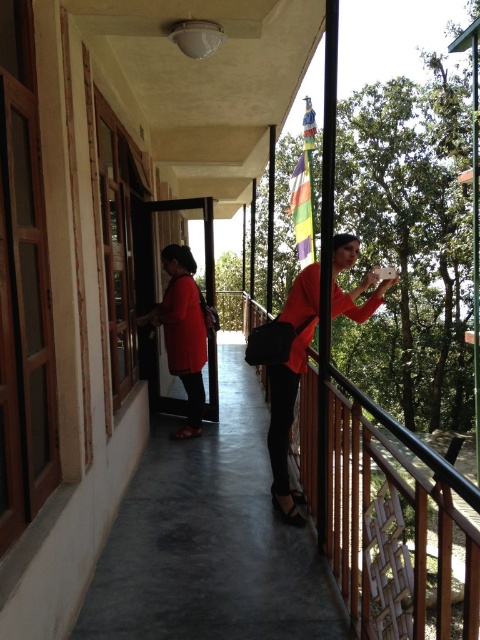
You are standing on the balcony and want to take a photo of the rainbow fabric flag at upper center without including the person in the matte red shirt at left. Based on their positions, is this possible?

The matte red shirt at left is positioned on the left side of the rainbow fabric flag at upper center. Therefore, if you move to the right side of the flag, you can frame the shot to exclude the person in the matte red shirt at left.